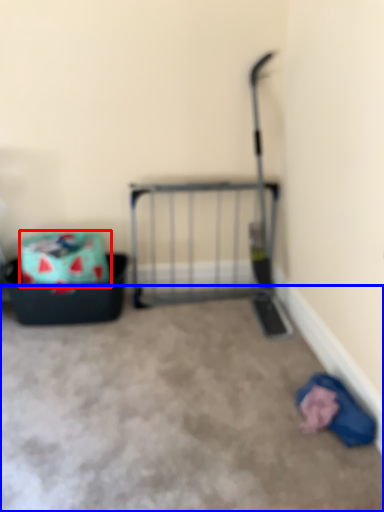
Question: Which object is further to the camera taking this photo, storage box (highlighted by a red box) or concrete (highlighted by a blue box)?

Choices:
 (A) storage box
 (B) concrete

Answer: (A)